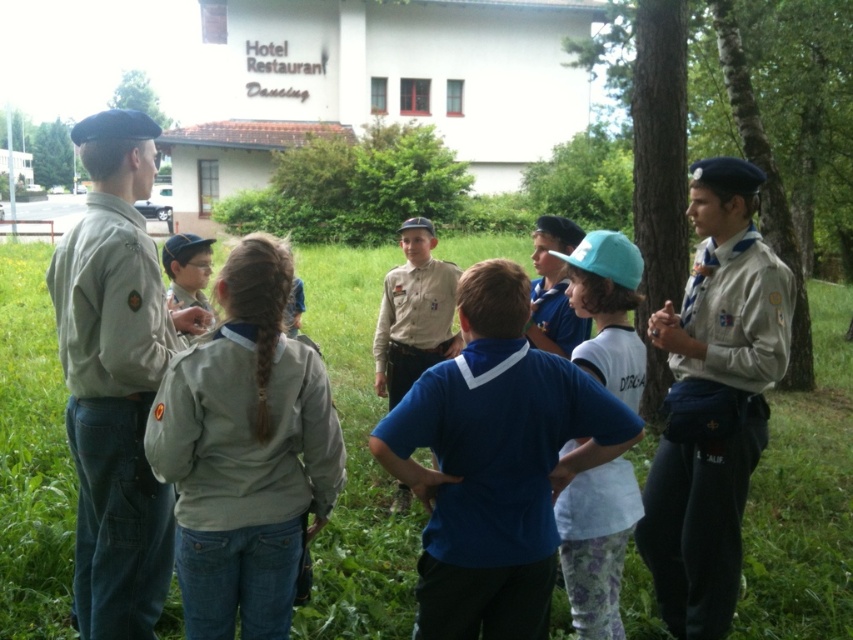
You are a scout leader trying to identify the shortest uniform among the khaki fabric uniform at center and the khaki fabric uniform at left. Which one should you choose?

The khaki fabric uniform at center is shorter than the khaki fabric uniform at left, so you should choose the khaki fabric uniform at center.